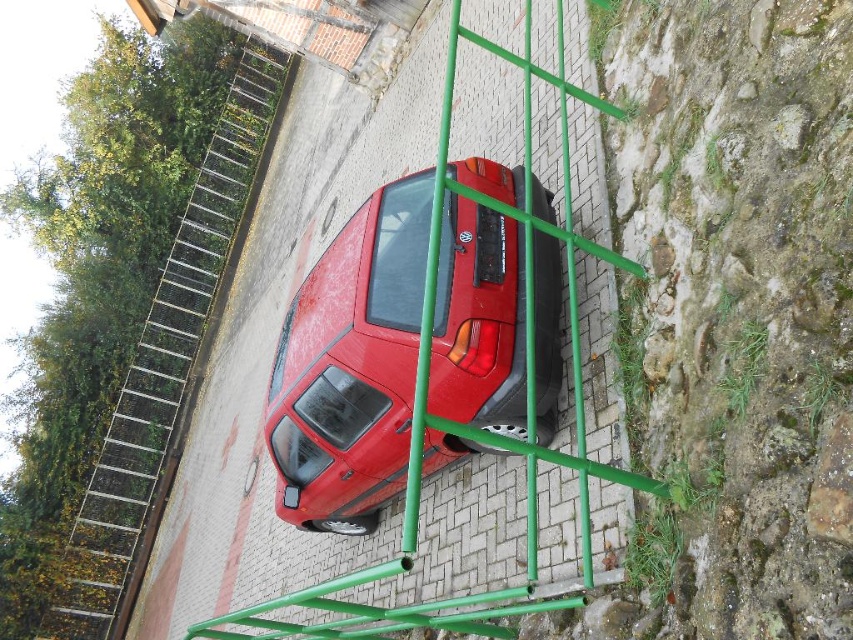
Question: Where is glossy red car at center located in relation to green metal ladder at center in the image?

Choices:
 (A) above
 (B) below

Answer: (A)

Question: Among these points, which one is nearest to the camera?

Choices:
 (A) (242, 81)
 (B) (415, 380)
 (C) (450, 406)

Answer: (C)

Question: Which point is farther to the camera?

Choices:
 (A) (281, 65)
 (B) (598, 99)
 (C) (265, 435)

Answer: (A)

Question: Which is nearer to the green metal ladder at center?

Choices:
 (A) metallic silver ladder at upper left
 (B) glossy red car at center

Answer: (B)

Question: From the image, what is the correct spatial relationship of green metal ladder at center in relation to metallic silver ladder at upper left?

Choices:
 (A) above
 (B) below

Answer: (B)

Question: Is green metal ladder at center closer to the viewer compared to metallic silver ladder at upper left?

Choices:
 (A) no
 (B) yes

Answer: (B)